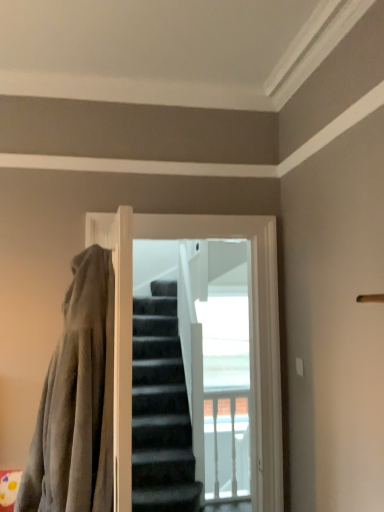
Question: Is velvety gray blanket at left facing towards dark gray carpeted stairs at center?

Choices:
 (A) no
 (B) yes

Answer: (A)

Question: Is velvety gray blanket at left facing away from dark gray carpeted stairs at center?

Choices:
 (A) yes
 (B) no

Answer: (A)

Question: Considering the relative positions of velvety gray blanket at left and dark gray carpeted stairs at center in the image provided, is velvety gray blanket at left behind dark gray carpeted stairs at center?

Choices:
 (A) no
 (B) yes

Answer: (A)

Question: Would you consider velvety gray blanket at left to be distant from dark gray carpeted stairs at center?

Choices:
 (A) yes
 (B) no

Answer: (A)

Question: Can you confirm if velvety gray blanket at left is smaller than dark gray carpeted stairs at center?

Choices:
 (A) yes
 (B) no

Answer: (B)

Question: Is the position of velvety gray blanket at left less distant than that of dark gray carpeted stairs at center?

Choices:
 (A) no
 (B) yes

Answer: (B)

Question: Does dark gray carpeted stairs at center have a larger size compared to velvety gray blanket at left?

Choices:
 (A) no
 (B) yes

Answer: (A)

Question: Would you say dark gray carpeted stairs at center is outside velvety gray blanket at left?

Choices:
 (A) no
 (B) yes

Answer: (B)

Question: From the image's perspective, is dark gray carpeted stairs at center above velvety gray blanket at left?

Choices:
 (A) no
 (B) yes

Answer: (A)

Question: From a real-world perspective, is dark gray carpeted stairs at center below velvety gray blanket at left?

Choices:
 (A) no
 (B) yes

Answer: (A)

Question: Considering the relative positions of dark gray carpeted stairs at center and velvety gray blanket at left in the image provided, is dark gray carpeted stairs at center behind velvety gray blanket at left?

Choices:
 (A) no
 (B) yes

Answer: (B)

Question: Is dark gray carpeted stairs at center oriented towards velvety gray blanket at left?

Choices:
 (A) no
 (B) yes

Answer: (A)

Question: From their relative heights in the image, would you say dark gray carpeted stairs at center is taller or shorter than velvety gray blanket at left?

Choices:
 (A) tall
 (B) short

Answer: (A)